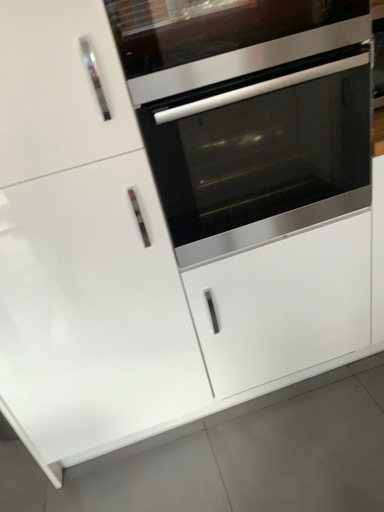
Where is `stainless steel oven at center`? The width and height of the screenshot is (384, 512). stainless steel oven at center is located at coordinates (262, 154).

Locate an element on the screen. This screenshot has height=512, width=384. white glossy drawer at center is located at coordinates (283, 304).

Is stainless steel oven at center spatially inside stainless steel oven at center, or outside of it?

stainless steel oven at center is not inside stainless steel oven at center, it's outside.

Find the location of a particular element. The height and width of the screenshot is (512, 384). vent above the stainless steel oven at center (from the image's perspective) is located at coordinates click(224, 38).

Considering the relative sizes of stainless steel oven at center and stainless steel oven at center in the image provided, is stainless steel oven at center shorter than stainless steel oven at center?

No, stainless steel oven at center is not shorter than stainless steel oven at center.

What's the angular difference between stainless steel oven at center and stainless steel oven at center's facing directions?

The angular difference between stainless steel oven at center and stainless steel oven at center is 0.000234 degrees.

From the image's perspective, who appears lower, white glossy door at center or stainless steel oven at center?

white glossy door at center appears lower in the image.

From the picture: Is white glossy door at center situated inside stainless steel oven at center or outside?

white glossy door at center is outside stainless steel oven at center.

Is white glossy door at center positioned with its back to stainless steel oven at center?

white glossy door at center does not have its back to stainless steel oven at center.

Between white glossy door at center and stainless steel oven at center, which one appears on the right side from the viewer's perspective?

stainless steel oven at center.

Is stainless steel oven at center a part of white glossy door at center?

That's incorrect, stainless steel oven at center is not inside white glossy door at center.

Considering the sizes of objects white glossy door at center and stainless steel oven at center in the image provided, who is bigger, white glossy door at center or stainless steel oven at center?

white glossy door at center is bigger.

From a real-world perspective, is white glossy door at center positioned under stainless steel oven at center based on gravity?

Yes, from a real-world perspective, white glossy door at center is under stainless steel oven at center.

Between white glossy door at center and stainless steel oven at center, which one is positioned in front?

Positioned in front is white glossy door at center.

Looking at this image, which is more distant, (297, 161) or (44, 274)?

The point (297, 161) is behind.

Considering the positions of objects stainless steel oven at center and white glossy door at center in the image provided, who is behind, stainless steel oven at center or white glossy door at center?

Positioned behind is stainless steel oven at center.

Is the position of white glossy door at center more distant than that of white glossy drawer at center?

That is False.

From the picture: Does white glossy door at center have a greater width compared to white glossy drawer at center?

Incorrect, the width of white glossy door at center does not surpass that of white glossy drawer at center.

Consider the image. Are white glossy door at center and white glossy drawer at center making contact?

white glossy door at center and white glossy drawer at center are clearly separated.

Which object is positioned more to the right, white glossy door at center or white glossy drawer at center?

From the viewer's perspective, white glossy drawer at center appears more on the right side.

Considering the relative sizes of stainless steel oven at center and white glossy door at center in the image provided, is stainless steel oven at center bigger than white glossy door at center?

Actually, stainless steel oven at center might be smaller than white glossy door at center.

Could white glossy door at center be considered to be inside stainless steel oven at center?

Actually, white glossy door at center is outside stainless steel oven at center.

Is stainless steel oven at center oriented towards white glossy door at center?

No, stainless steel oven at center is not turned towards white glossy door at center.

Which of these two, stainless steel oven at center or white glossy drawer at center, is smaller?

stainless steel oven at center.

Between point (130, 59) and point (314, 267), which one is positioned in front?

The point (130, 59) is more forward.

Is stainless steel oven at center taller or shorter than white glossy drawer at center?

Considering their sizes, stainless steel oven at center has less height than white glossy drawer at center.

Considering the relative positions of stainless steel oven at center and white glossy drawer at center in the image provided, is stainless steel oven at center to the left of white glossy drawer at center from the viewer's perspective?

Indeed, stainless steel oven at center is positioned on the left side of white glossy drawer at center.

I want to click on vent on the left of stainless steel oven at center, so click(x=224, y=38).

Identify the location of vent above the white glossy door at center (from the image's perspective). click(224, 38).

Looking at the image, which one is located further to white glossy door at center, stainless steel oven at center or white glossy drawer at center?

stainless steel oven at center is further to white glossy door at center.

Which object lies further to the anchor point stainless steel oven at center, white glossy door at center or stainless steel oven at center?

Based on the image, white glossy door at center appears to be further to stainless steel oven at center.

Considering their positions, is stainless steel oven at center positioned further to stainless steel oven at center than white glossy door at center?

Based on the image, white glossy door at center appears to be further to stainless steel oven at center.

Estimate the real-world distances between objects in this image. Which object is further from stainless steel oven at center, white glossy door at center or stainless steel oven at center?

Based on the image, white glossy door at center appears to be further to stainless steel oven at center.

When comparing their distances from white glossy drawer at center, does white glossy door at center or stainless steel oven at center seem closer?

white glossy door at center.

Estimate the real-world distances between objects in this image. Which object is further from stainless steel oven at center, stainless steel oven at center or white glossy door at center?

white glossy door at center is positioned further to the anchor stainless steel oven at center.

Considering their positions, is white glossy drawer at center positioned closer to stainless steel oven at center than white glossy door at center?

Among the two, white glossy drawer at center is located nearer to stainless steel oven at center.

Considering their positions, is stainless steel oven at center positioned further to white glossy door at center than white glossy drawer at center?

Among the two, stainless steel oven at center is located further to white glossy door at center.

This screenshot has width=384, height=512. I want to click on oven between white glossy door at center and white glossy drawer at center from left to right, so click(262, 154).

Where is `vent situated between white glossy door at center and stainless steel oven at center from left to right`? The height and width of the screenshot is (512, 384). vent situated between white glossy door at center and stainless steel oven at center from left to right is located at coordinates (224, 38).

The image size is (384, 512). What are the coordinates of `oven between stainless steel oven at center and white glossy drawer at center in the vertical direction` in the screenshot? It's located at (262, 154).

This screenshot has width=384, height=512. In order to click on door between stainless steel oven at center and white glossy drawer at center in the vertical direction in this screenshot , I will do `click(92, 315)`.